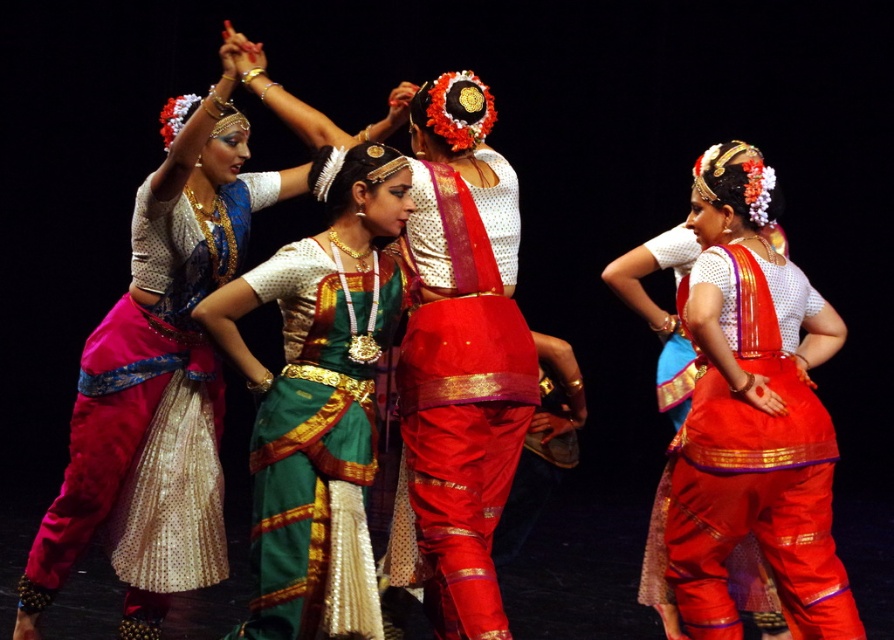
You are standing in the audience watching the dance performance. There is a point at coordinates point (218, 244) on the stage. If you want to throw a flower bouquet to that point, will it land within 5 meters from you?

The distance of point (218, 244) from viewer is 4.11 meters, so yes, the flower bouquet will land within 5 meters from you since 4.11 meters is less than 5 meters.

You are a photographer capturing the dancers on stage. You notice the pink sequined skirt at left and the shiny red fabric saree at right. Which object is higher in the frame?

The pink sequined skirt at left is taller than the shiny red fabric saree at right, so it is higher in the frame.

You are a photographer standing at the center of the stage, and you want to take a photo of both the point at location point (135, 342) and point (351, 602). Which point is closer to you?

Point (135, 342) is further to the viewer than point (351, 602), so the point closer to you is point (351, 602).